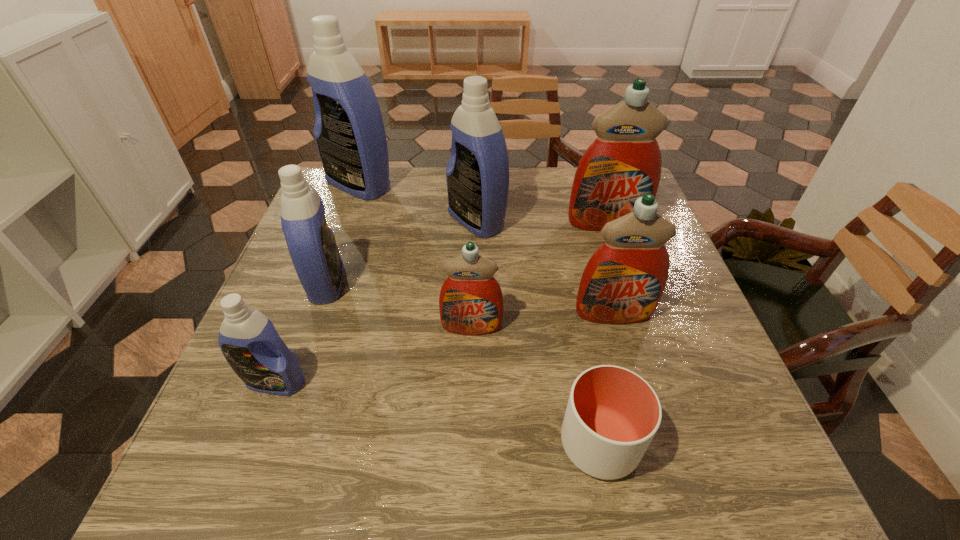
Where is `free region that satisfies the following two spatial constraints: 1. on the back side of the nearest blue detergent; 2. on the left side of the tallest detergent`? The height and width of the screenshot is (540, 960). free region that satisfies the following two spatial constraints: 1. on the back side of the nearest blue detergent; 2. on the left side of the tallest detergent is located at coordinates (351, 185).

Locate an element on the screen. free space that satisfies the following two spatial constraints: 1. on the front surface of the leftmost red detergent; 2. on the right side of the nearest object is located at coordinates (469, 443).

You are a GUI agent. You are given a task and a screenshot of the screen. Output one action in this format:
    pyautogui.click(x=<x>, y=<y>)
    Task: Click on the free spot that satisfies the following two spatial constraints: 1. on the front side of the third farthest blue detergent; 2. on the left side of the white cup
    The width and height of the screenshot is (960, 540).
    Given the screenshot: What is the action you would take?
    pyautogui.click(x=270, y=443)

At what (x,y) coordinates should I click in order to perform the action: click on free location that satisfies the following two spatial constraints: 1. on the front surface of the leftmost red detergent; 2. on the right side of the nearest object. Please return your answer as a coordinate pair (x, y). The width and height of the screenshot is (960, 540). Looking at the image, I should click on (469, 443).

Identify the location of free space that satisfies the following two spatial constraints: 1. on the front side of the rightmost blue detergent; 2. on the right side of the shortest object. (474, 443).